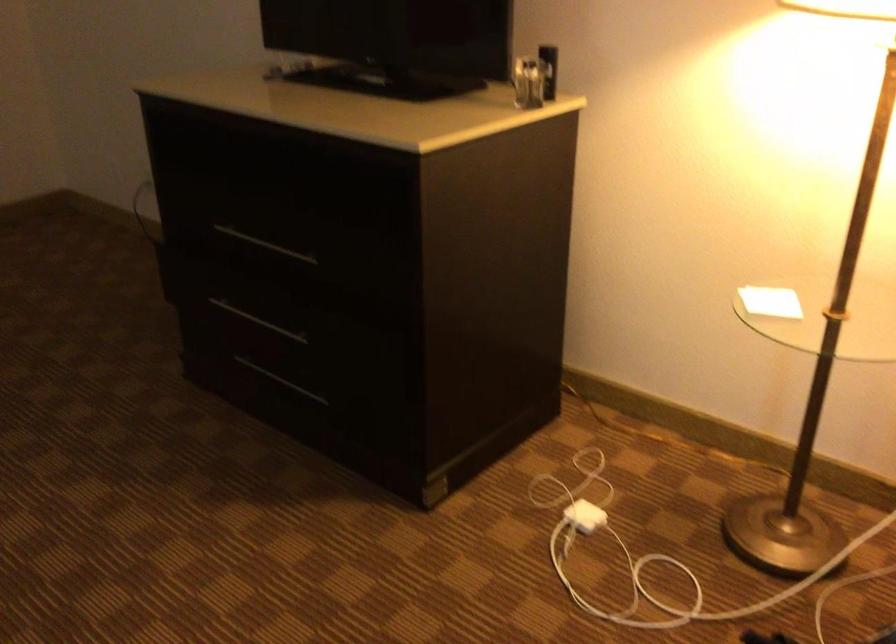
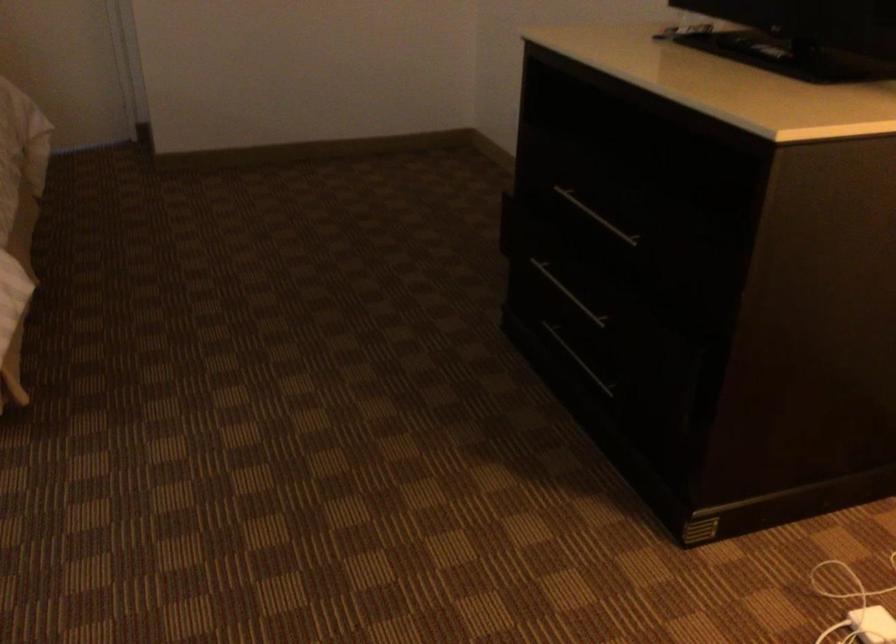
Question: The images are taken continuously from a first-person perspective. In which direction is your viewpoint rotating?

Choices:
 (A) Left
 (B) Right
 (C) Up
 (D) Down

Answer: (A)